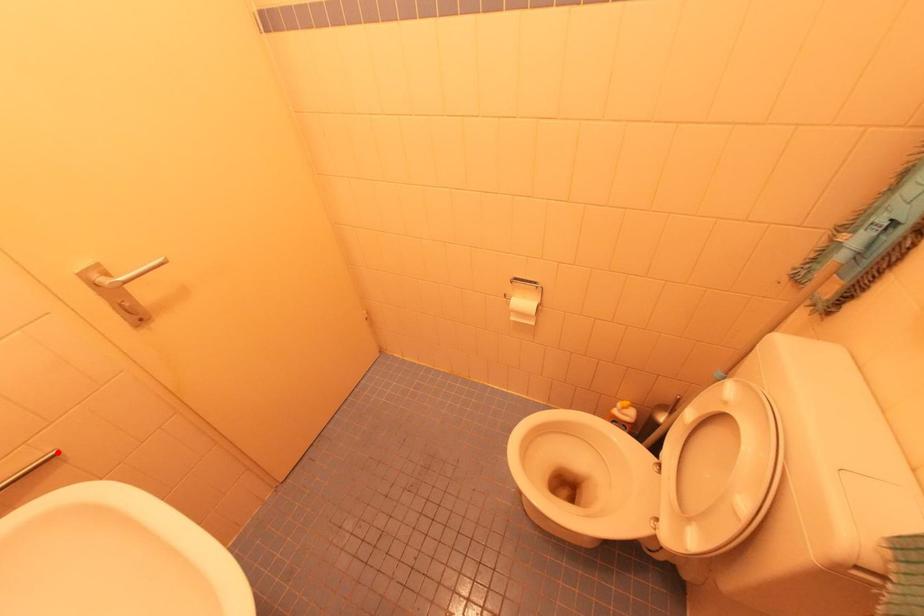
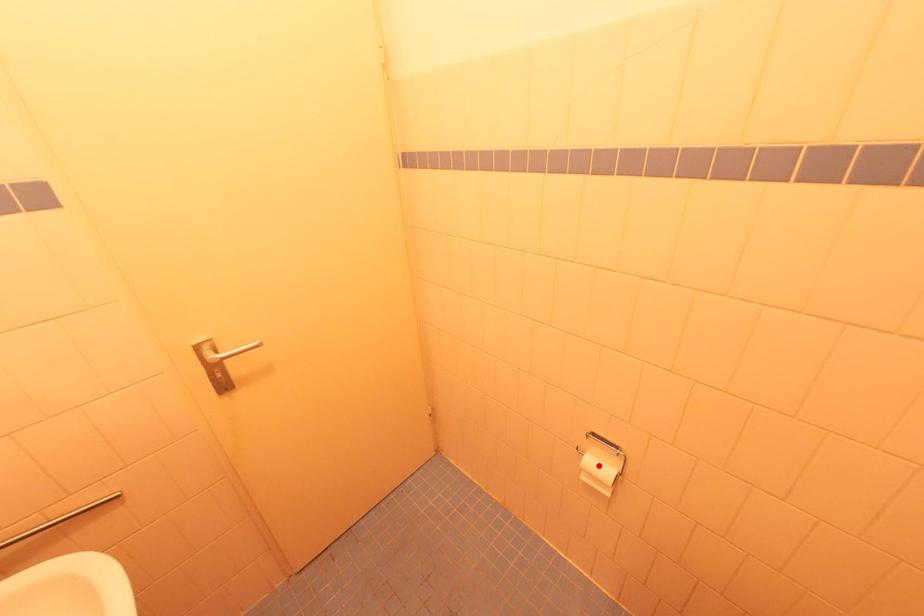
I am providing you with two images of the same scene from different viewpoints. A red point is marked on the first image and another point is marked on the second image. Are the points marked in image1 and image2 representing the same 3D position?

No